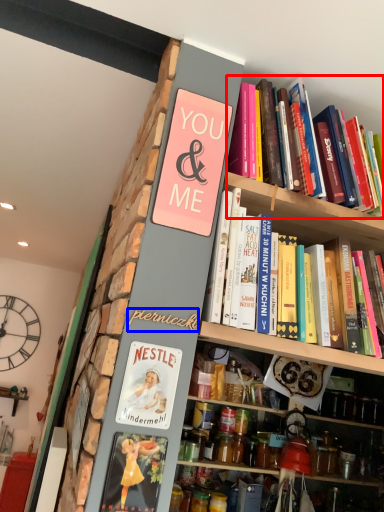
Question: Which object is further to the camera taking this photo, book (highlighted by a red box) or writing (highlighted by a blue box)?

Choices:
 (A) book
 (B) writing

Answer: (A)